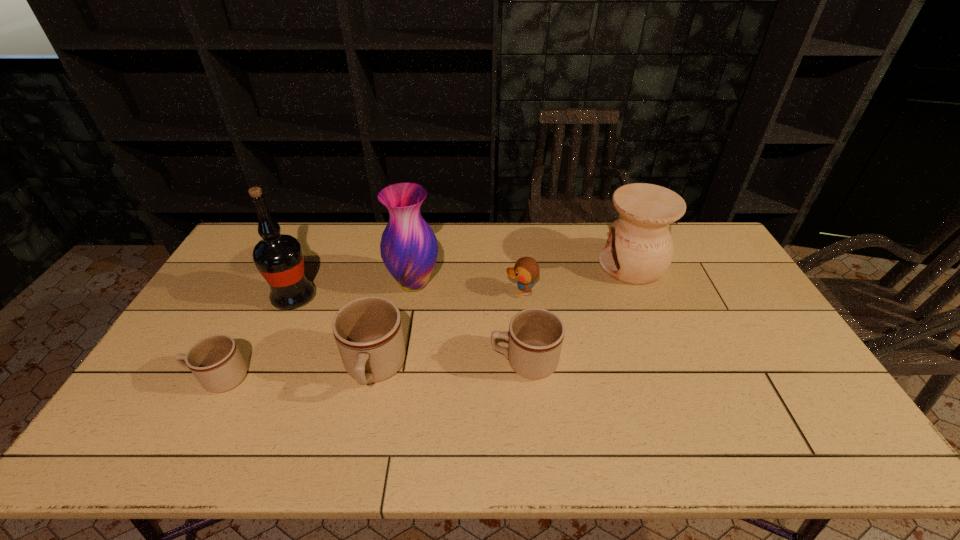
Locate an element on the screen. This screenshot has width=960, height=540. the shortest object is located at coordinates (216, 362).

Where is `the shortest mug`? The height and width of the screenshot is (540, 960). the shortest mug is located at coordinates pyautogui.click(x=216, y=362).

This screenshot has width=960, height=540. In order to click on the tallest mug in this screenshot , I will do `click(368, 332)`.

Locate an element on the screen. The width and height of the screenshot is (960, 540). the second mug from left to right is located at coordinates (368, 332).

I want to click on the second shortest mug, so click(535, 337).

In order to click on duck in this screenshot , I will do `click(526, 269)`.

Identify the location of wine bottle. The height and width of the screenshot is (540, 960). (279, 258).

The height and width of the screenshot is (540, 960). What are the coordinates of `the second tallest object` in the screenshot? It's located at (409, 249).

At what (x,y) coordinates should I click in order to perform the action: click on pottery. Please return your answer as a coordinate pair (x, y). Looking at the image, I should click on (639, 250).

Identify the location of the rightmost object. This screenshot has height=540, width=960. (639, 250).